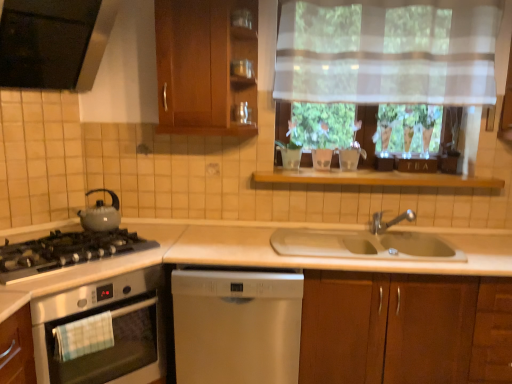
Question: Does wooden cabinet at upper center, which is the second cabinetry in bottom-to-top order, have a lesser width compared to matte gray gas stove at left?

Choices:
 (A) no
 (B) yes

Answer: (B)

Question: From a real-world perspective, is wooden cabinet at upper center, placed as the 1th cabinetry when sorted from top to bottom, positioned under matte gray gas stove at left based on gravity?

Choices:
 (A) no
 (B) yes

Answer: (A)

Question: Can you confirm if wooden cabinet at upper center, which is the 1th cabinetry from left to right, is taller than matte gray gas stove at left?

Choices:
 (A) no
 (B) yes

Answer: (B)

Question: Is wooden cabinet at upper center, acting as the second cabinetry starting from the right, aimed at matte gray gas stove at left?

Choices:
 (A) no
 (B) yes

Answer: (A)

Question: From a real-world perspective, is wooden cabinet at upper center, acting as the second cabinetry starting from the right, over matte gray gas stove at left?

Choices:
 (A) no
 (B) yes

Answer: (B)

Question: From a real-world perspective, is wooden shelf at center physically located above or below matte gray gas stove at left?

Choices:
 (A) above
 (B) below

Answer: (A)

Question: Is point (302, 173) positioned closer to the camera than point (47, 248)?

Choices:
 (A) farther
 (B) closer

Answer: (A)

Question: Relative to matte gray gas stove at left, is wooden shelf at center in front or behind?

Choices:
 (A) front
 (B) behind

Answer: (B)

Question: Looking at their shapes, would you say wooden shelf at center is wider or thinner than matte gray gas stove at left?

Choices:
 (A) wide
 (B) thin

Answer: (B)

Question: From the image's perspective, relative to matte gray kettle at left, which appears as the 2th kitchen appliance when ordered from the bottom, is wooden cabinet at upper center, acting as the second cabinetry starting from the right, above or below?

Choices:
 (A) below
 (B) above

Answer: (B)

Question: Relative to matte gray kettle at left, positioned as the 1th kitchen appliance in top-to-bottom order, is wooden cabinet at upper center, which is the second cabinetry in bottom-to-top order, in front or behind?

Choices:
 (A) behind
 (B) front

Answer: (B)

Question: From a real-world perspective, is wooden cabinet at upper center, which is the 1th cabinetry from left to right, above or below matte gray kettle at left, which appears as the 2th kitchen appliance when ordered from the bottom?

Choices:
 (A) below
 (B) above

Answer: (B)

Question: Is wooden cabinet at upper center, which is the second cabinetry in bottom-to-top order, inside or outside of matte gray kettle at left, positioned as the 1th kitchen appliance in top-to-bottom order?

Choices:
 (A) outside
 (B) inside

Answer: (A)

Question: Considering the positions of matte gray kettle at left, which appears as the 2th kitchen appliance when ordered from the bottom, and stainless steel oven at left, the first kitchen appliance in the bottom-to-top sequence, in the image, is matte gray kettle at left, which appears as the 2th kitchen appliance when ordered from the bottom, taller or shorter than stainless steel oven at left, the first kitchen appliance in the bottom-to-top sequence,?

Choices:
 (A) short
 (B) tall

Answer: (A)

Question: Is point pyautogui.click(x=99, y=188) closer or farther from the camera than point pyautogui.click(x=112, y=377)?

Choices:
 (A) farther
 (B) closer

Answer: (A)